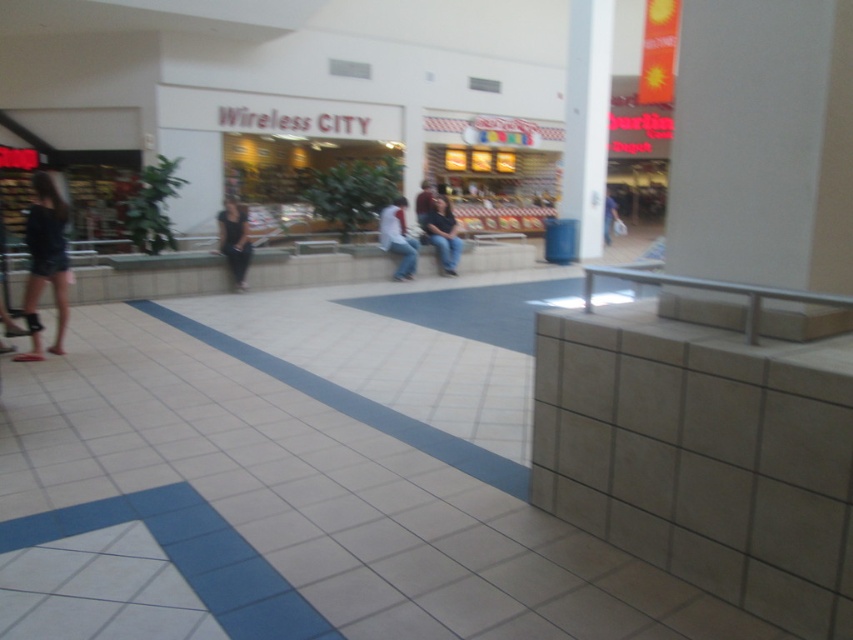
Can you confirm if dark blue shorts at left is thinner than matte black jacket at center?

Incorrect, dark blue shorts at left's width is not less than matte black jacket at center's.

Does point (39, 262) come farther from viewer compared to point (421, 221)?

No, it is not.

Is point (59, 346) farther from camera compared to point (421, 218)?

No, (59, 346) is closer to viewer.

Locate an element on the screen. Image resolution: width=853 pixels, height=640 pixels. dark blue shorts at left is located at coordinates (45, 262).

Who is positioned more to the right, white glossy pillar at upper center or dark gray pants at center?

white glossy pillar at upper center

How much distance is there between white glossy pillar at upper center and dark gray pants at center?

7.62 meters

This screenshot has width=853, height=640. Describe the element at coordinates (585, 120) in the screenshot. I see `white glossy pillar at upper center` at that location.

Locate an element on the screen. The image size is (853, 640). white glossy pillar at upper center is located at coordinates (585, 120).

Can you confirm if white glossy pillar at upper center is shorter than denim jeans at center?

Incorrect, white glossy pillar at upper center's height does not fall short of denim jeans at center's.

Which is more to the left, white glossy pillar at upper center or denim jeans at center?

Positioned to the left is denim jeans at center.

Does point (607, 99) come closer to viewer compared to point (456, 252)?

No.

Locate an element on the screen. This screenshot has width=853, height=640. white glossy pillar at upper center is located at coordinates (585, 120).